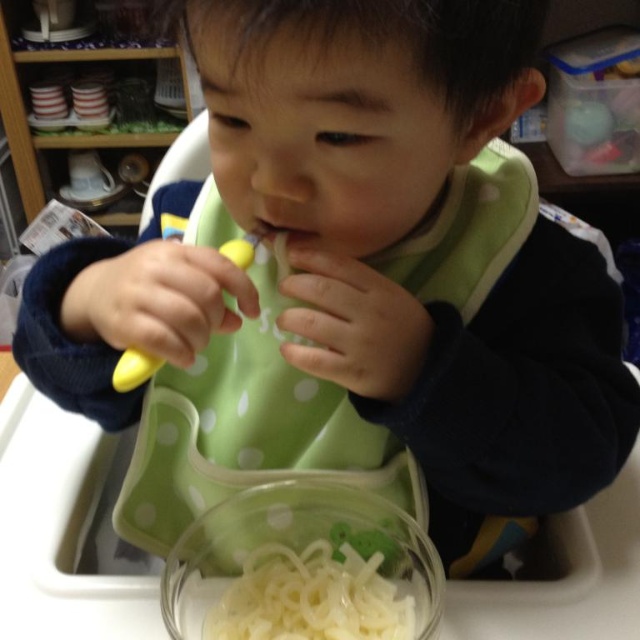
Question: Based on their relative distances, which object is nearer to the white glossy noodles at lower center?

Choices:
 (A) translucent plastic bowl at lower center
 (B) pink matte flesh at center

Answer: (A)

Question: Does white glossy noodles at lower center lie in front of pink matte flesh at center?

Choices:
 (A) yes
 (B) no

Answer: (B)

Question: Considering the real-world distances, which object is farthest from the pink matte flesh at center?

Choices:
 (A) white glossy noodles at lower center
 (B) translucent plastic bowl at lower center

Answer: (A)

Question: Is translucent plastic bowl at lower center smaller than white glossy noodles at lower center?

Choices:
 (A) no
 (B) yes

Answer: (A)

Question: Which of the following is the farthest from the observer?

Choices:
 (A) pink matte flesh at center
 (B) translucent plastic bowl at lower center

Answer: (A)

Question: Considering the relative positions of translucent plastic bowl at lower center and pink matte flesh at center in the image provided, where is translucent plastic bowl at lower center located with respect to pink matte flesh at center?

Choices:
 (A) left
 (B) right

Answer: (B)